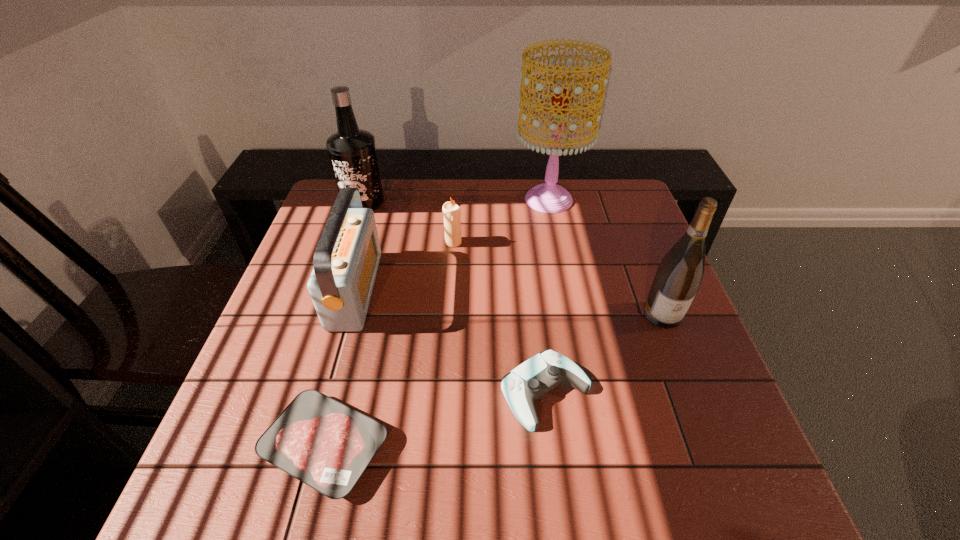
Where is `vacant space at the near right corner`? vacant space at the near right corner is located at coordinates (684, 501).

Find the location of a particular element. The width and height of the screenshot is (960, 540). blank region between the shortest object and the rightmost object is located at coordinates (494, 381).

The width and height of the screenshot is (960, 540). Identify the location of free space between the lampshade and the control. point(547,296).

I want to click on free space that is in between the second shortest object and the shortest object, so click(x=436, y=419).

You are a GUI agent. You are given a task and a screenshot of the screen. Output one action in this format:
    pyautogui.click(x=<x>, y=<y>)
    Task: Click on the vacant area between the liquor and the candle
    The image size is (960, 540).
    Given the screenshot: What is the action you would take?
    pyautogui.click(x=408, y=221)

Locate an element on the screen. This screenshot has height=540, width=960. vacant space that's between the lampshade and the sixth tallest object is located at coordinates (547, 296).

Where is `empty space between the rightmost object and the control`? The image size is (960, 540). empty space between the rightmost object and the control is located at coordinates (604, 353).

Where is `free space that is in between the steak and the lampshade`? The height and width of the screenshot is (540, 960). free space that is in between the steak and the lampshade is located at coordinates (437, 323).

Where is `empty location between the tallest object and the steak`? This screenshot has width=960, height=540. empty location between the tallest object and the steak is located at coordinates (437, 323).

I want to click on the fifth closest object relative to the radio receiver, so click(549, 197).